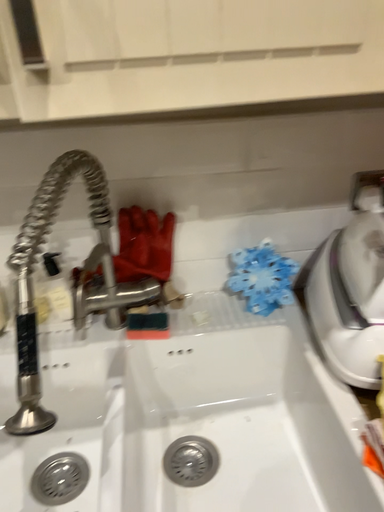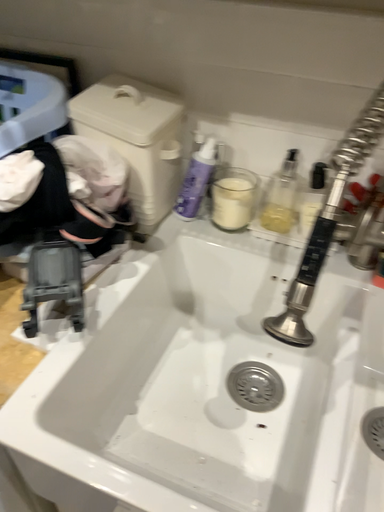
Question: How did the camera likely rotate when shooting the video?

Choices:
 (A) rotated left
 (B) rotated right

Answer: (A)